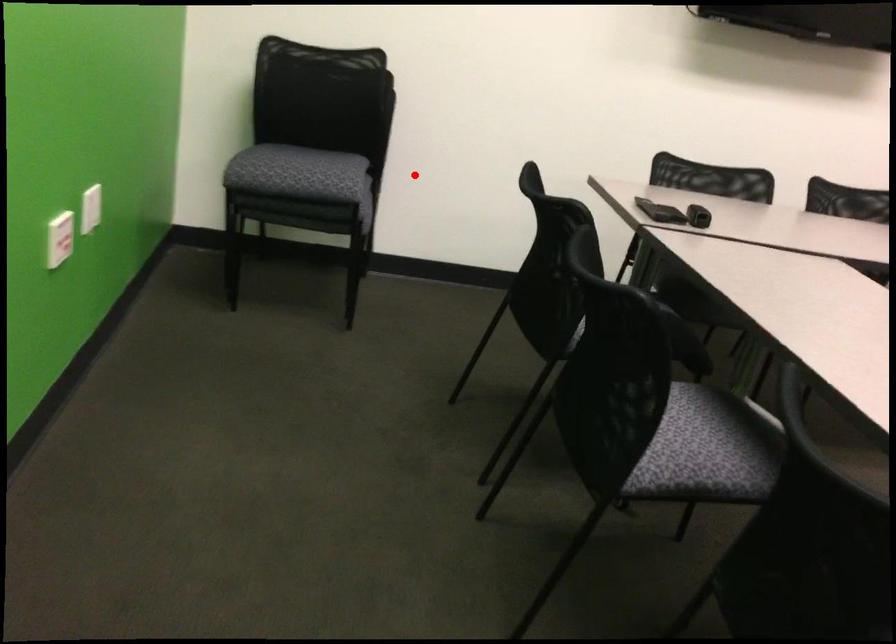
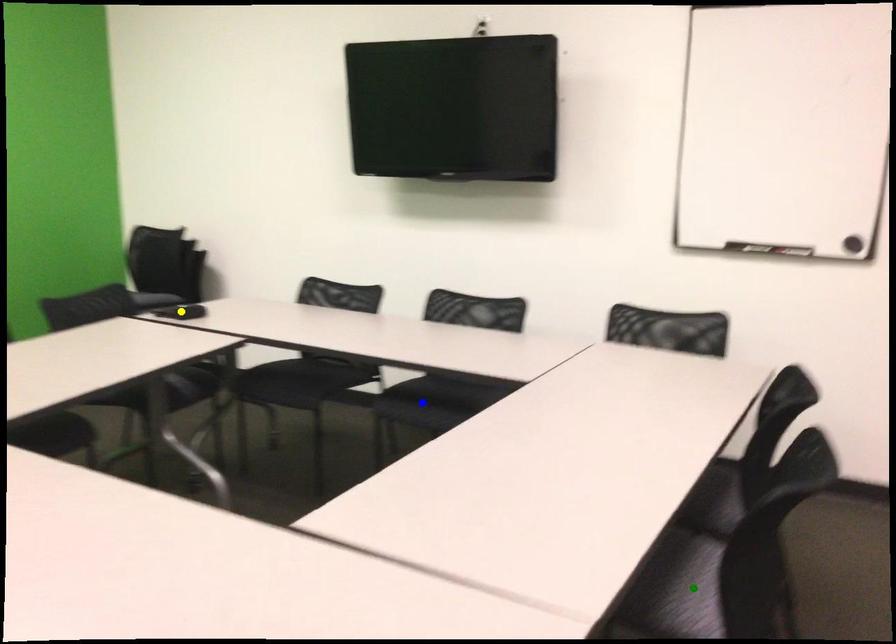
Question: I am providing you with two images of the same scene from different viewpoints. A red point is marked on the first image. You are given multiple points on the second image. In image 2, which mark is for the same physical point as the one in image 1?

Choices:
 (A) blue point
 (B) yellow point
 (C) green point

Answer: (B)